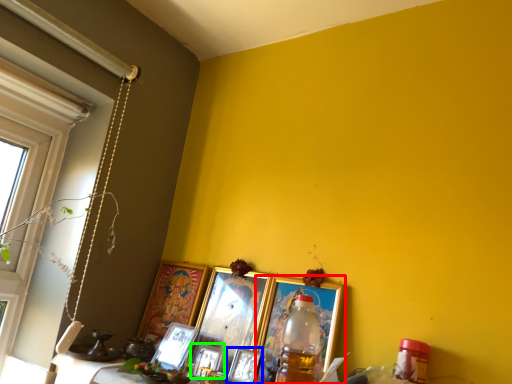
Question: Based on their relative distances, which object is farther from picture frame (highlighted by a red box)? Choose from picture frame (highlighted by a blue box) and picture frame (highlighted by a green box).

Choices:
 (A) picture frame
 (B) picture frame

Answer: (B)